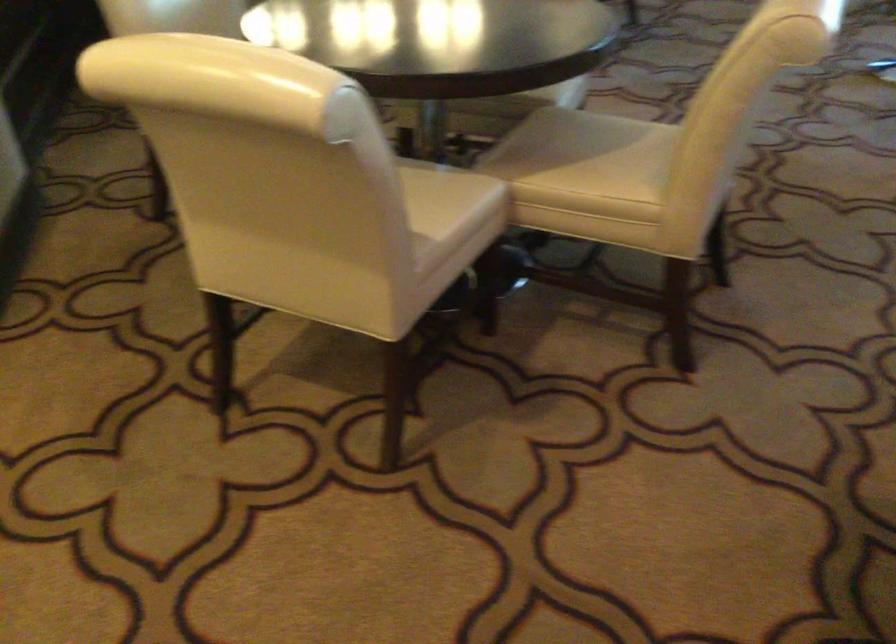
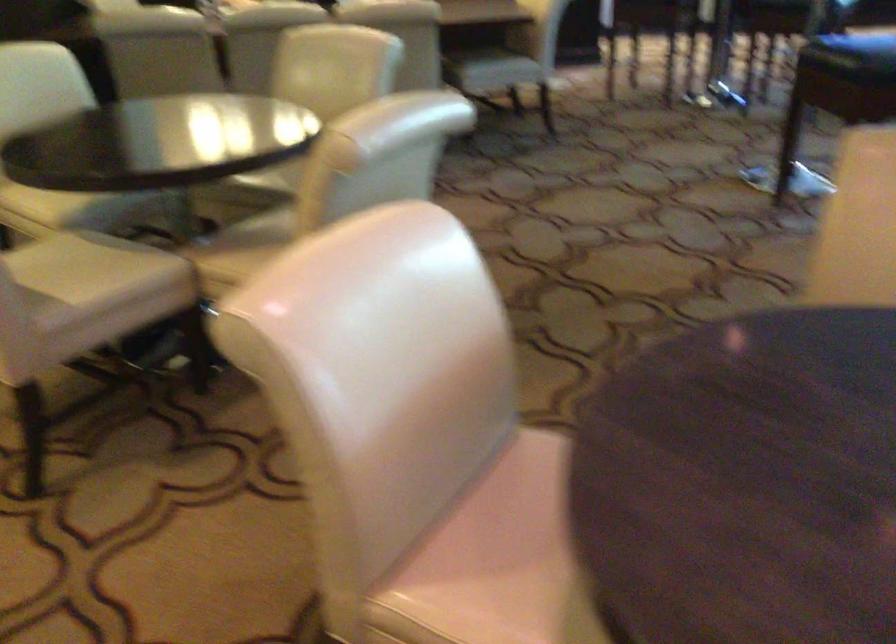
Question: The images are taken continuously from a first-person perspective. In which direction are you moving?

Choices:
 (A) Left
 (B) Right
 (C) Forward
 (D) Backward

Answer: (B)